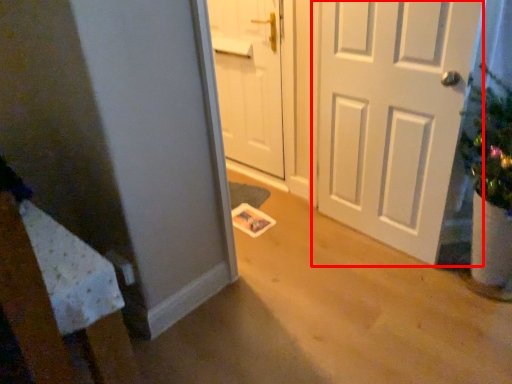
Question: In this image, where is door (annotated by the red box) located relative to door?

Choices:
 (A) left
 (B) right

Answer: (B)